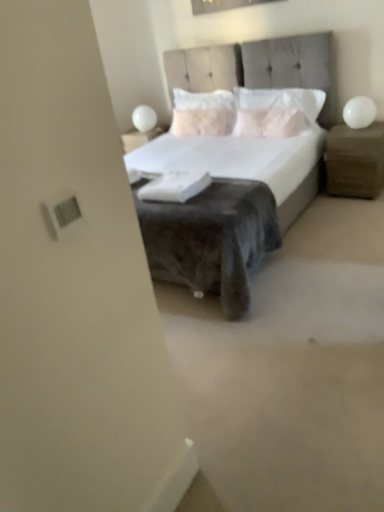
Question: Is white glossy table lamp at upper right, the 2th table lamp positioned from the top, facing away from velvet gray bed at center?

Choices:
 (A) no
 (B) yes

Answer: (A)

Question: Is white glossy table lamp at upper right, the 2th table lamp positioned from the top, positioned far away from velvet gray bed at center?

Choices:
 (A) no
 (B) yes

Answer: (A)

Question: Could you tell me if white glossy table lamp at upper right, acting as the 2th table lamp starting from the left, is facing velvet gray bed at center?

Choices:
 (A) no
 (B) yes

Answer: (A)

Question: Does white glossy table lamp at upper right, the second table lamp viewed from the back, appear on the left side of velvet gray bed at center?

Choices:
 (A) no
 (B) yes

Answer: (A)

Question: Can you see white glossy table lamp at upper right, positioned as the 1th table lamp in bottom-to-top order, touching velvet gray bed at center?

Choices:
 (A) no
 (B) yes

Answer: (A)

Question: From the image's perspective, is white textured pillow at center, marked as the 1th pillow in a left-to-right arrangement, positioned above or below white glossy sphere at upper left, positioned as the first table lamp in top-to-bottom order?

Choices:
 (A) below
 (B) above

Answer: (A)

Question: From a real-world perspective, relative to white glossy sphere at upper left, which is the second table lamp from bottom to top, is white textured pillow at center, which is the 2th pillow from right to left, vertically above or below?

Choices:
 (A) below
 (B) above

Answer: (B)

Question: In the image, is white textured pillow at center, which is the 2th pillow from right to left, on the left side or the right side of white glossy sphere at upper left, positioned as the 1th table lamp in back-to-front order?

Choices:
 (A) right
 (B) left

Answer: (A)

Question: Is point coord(178,133) positioned closer to the camera than point coord(147,114)?

Choices:
 (A) farther
 (B) closer

Answer: (B)

Question: Is white textured pillow at center, marked as the 1th pillow in a left-to-right arrangement, taller or shorter than white soft pillow at center, the first pillow in the right-to-left sequence?

Choices:
 (A) tall
 (B) short

Answer: (A)

Question: In terms of width, does white textured pillow at center, marked as the 1th pillow in a left-to-right arrangement, look wider or thinner when compared to white soft pillow at center, the first pillow in the right-to-left sequence?

Choices:
 (A) thin
 (B) wide

Answer: (A)

Question: From the image's perspective, is white textured pillow at center, which is the 2th pillow from right to left, positioned above or below white soft pillow at center, acting as the second pillow starting from the left?

Choices:
 (A) below
 (B) above

Answer: (B)

Question: From a real-world perspective, is white textured pillow at center, which is the 2th pillow from right to left, above or below white soft pillow at center, acting as the second pillow starting from the left?

Choices:
 (A) above
 (B) below

Answer: (A)

Question: Is wooden nightstand at right wider or thinner than white glossy table lamp at upper right, the second table lamp viewed from the back?

Choices:
 (A) wide
 (B) thin

Answer: (A)

Question: Visually, is wooden nightstand at right positioned to the left or to the right of white glossy table lamp at upper right, the second table lamp viewed from the back?

Choices:
 (A) right
 (B) left

Answer: (A)